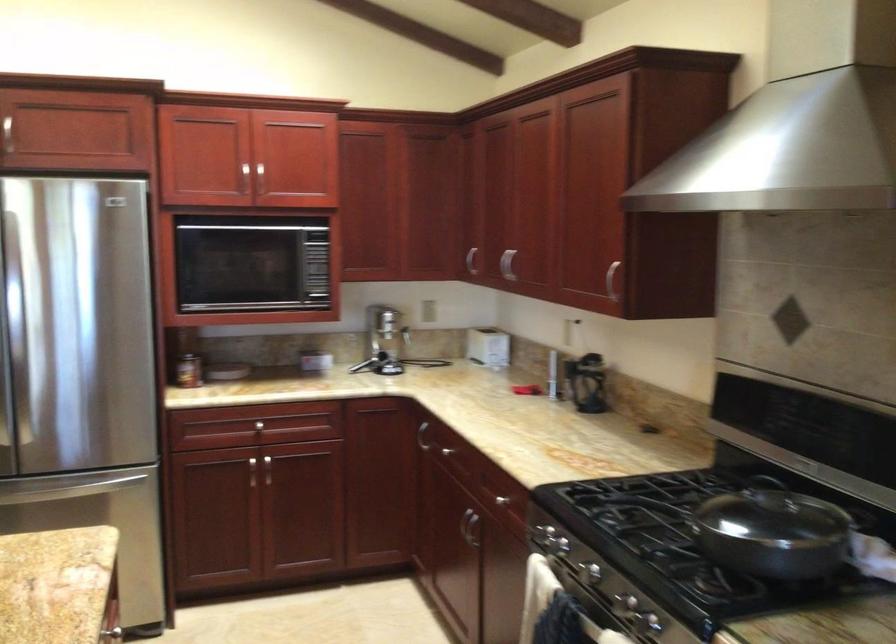
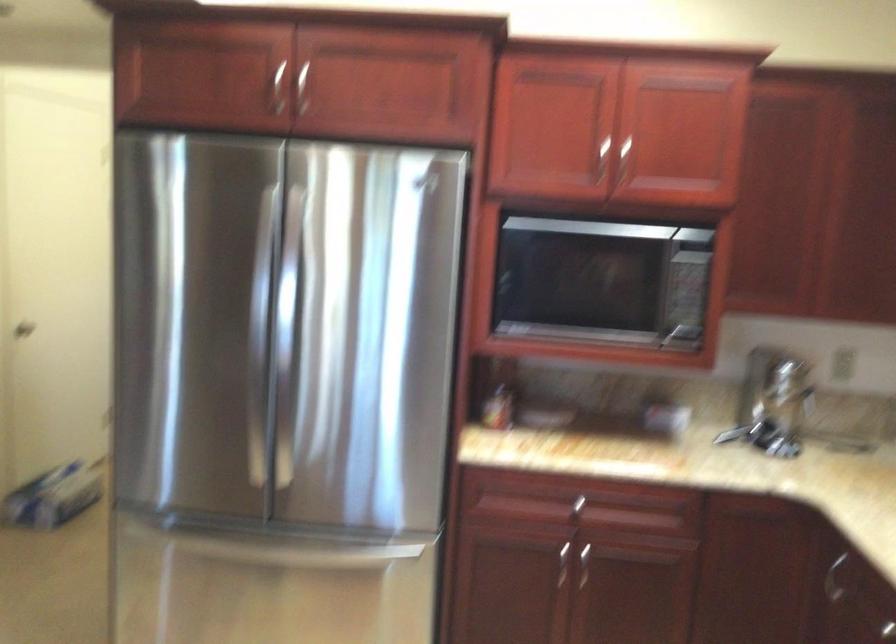
Question: The camera is either moving clockwise (left) or counter-clockwise (right) around the object. The first image is from the beginning of the video and the second image is from the end. Is the camera moving left or right when shooting the video?

Choices:
 (A) Left
 (B) Right

Answer: (B)